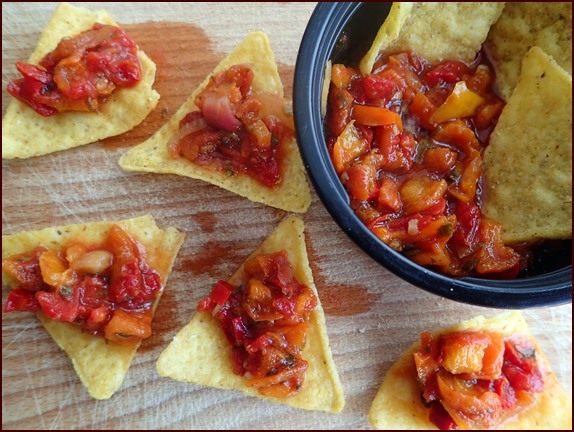
In order to click on bowl in this screenshot , I will do `click(515, 287)`.